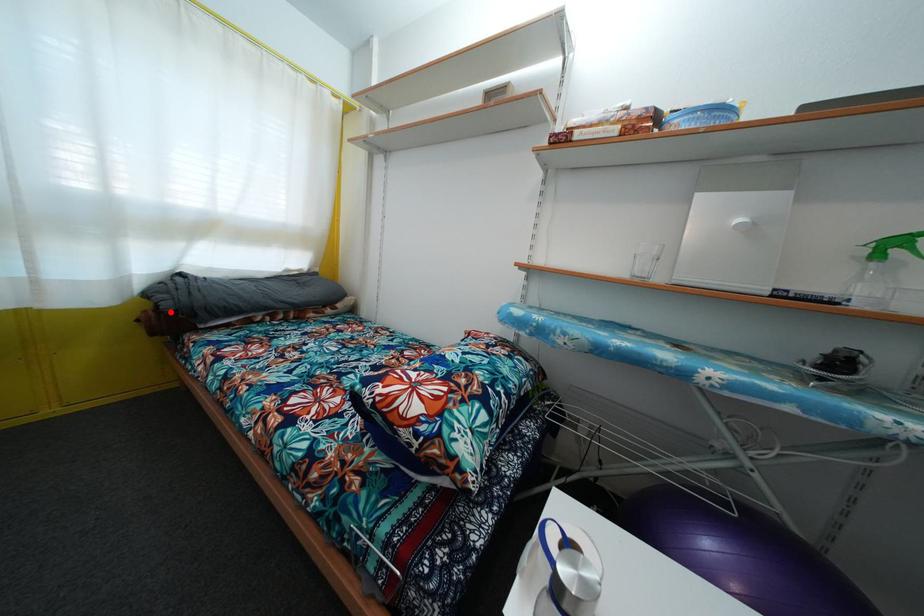
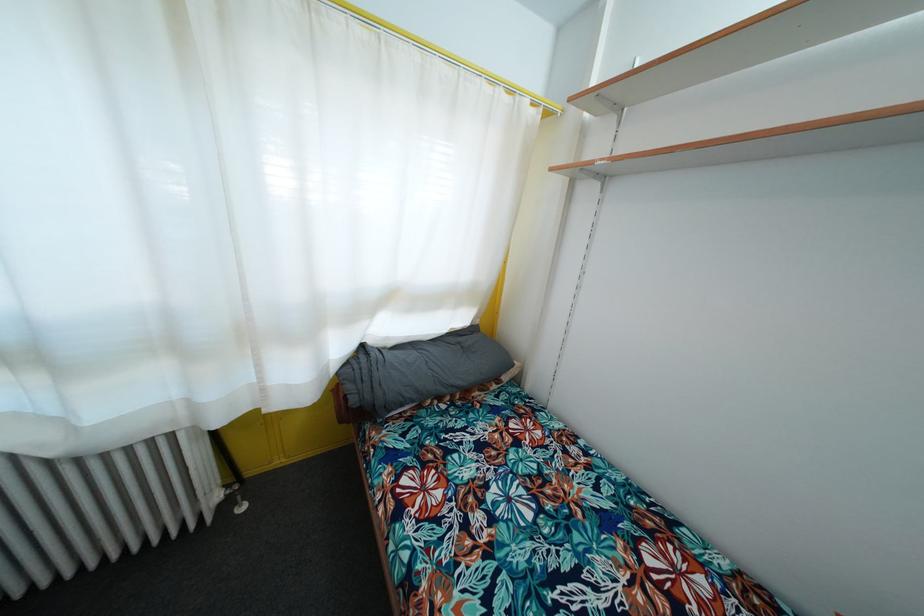
Question: I am providing you with two images of the same scene from different viewpoints. Image1 has a red point marked. In image2, the corresponding 3D location appears at what relative position? Reply with the corresponding letter.

Choices:
 (A) Closer
 (B) Farther

Answer: (B)